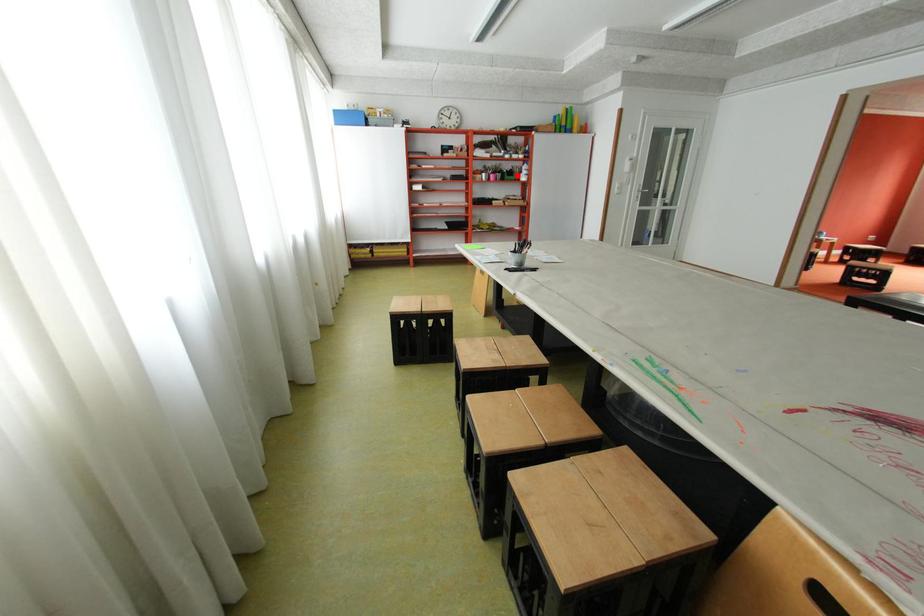
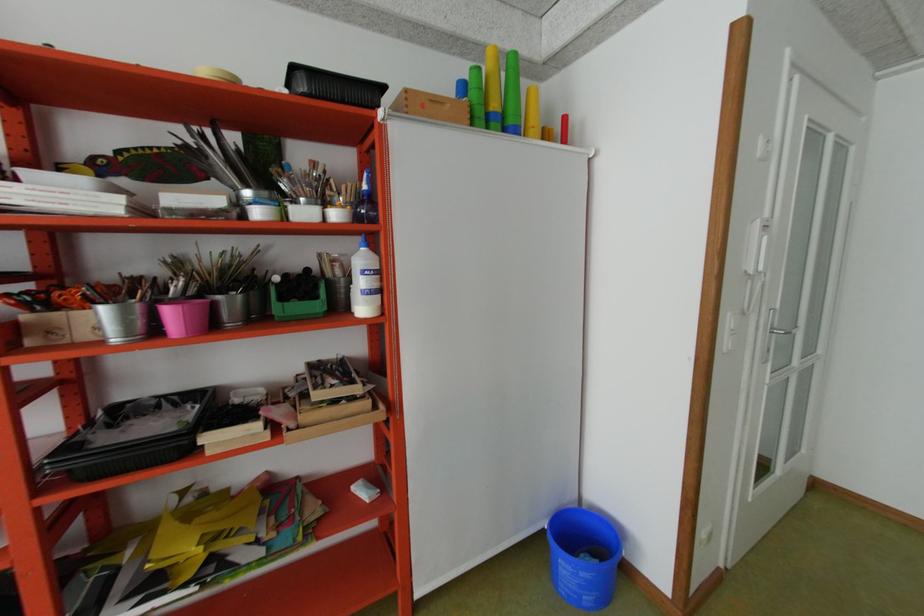
Question: I am providing you with two images of the same scene from different viewpoints. A red point is shown in image1. For the corresponding object point in image2, is it positioned nearer or farther from the camera?

Choices:
 (A) Nearer
 (B) Farther

Answer: (B)